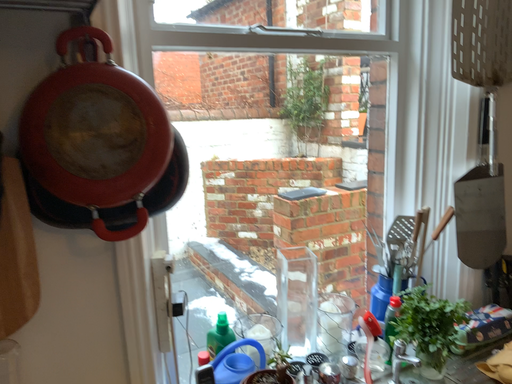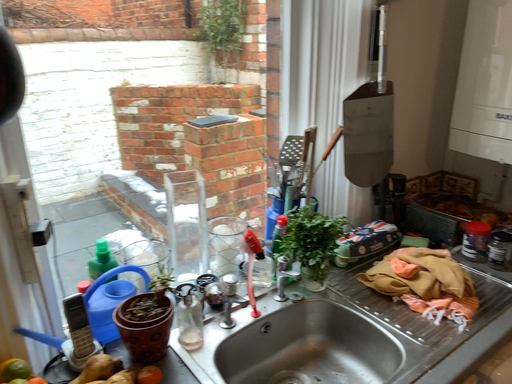
Question: How did the camera likely rotate when shooting the video?

Choices:
 (A) rotated downward
 (B) rotated upward

Answer: (A)